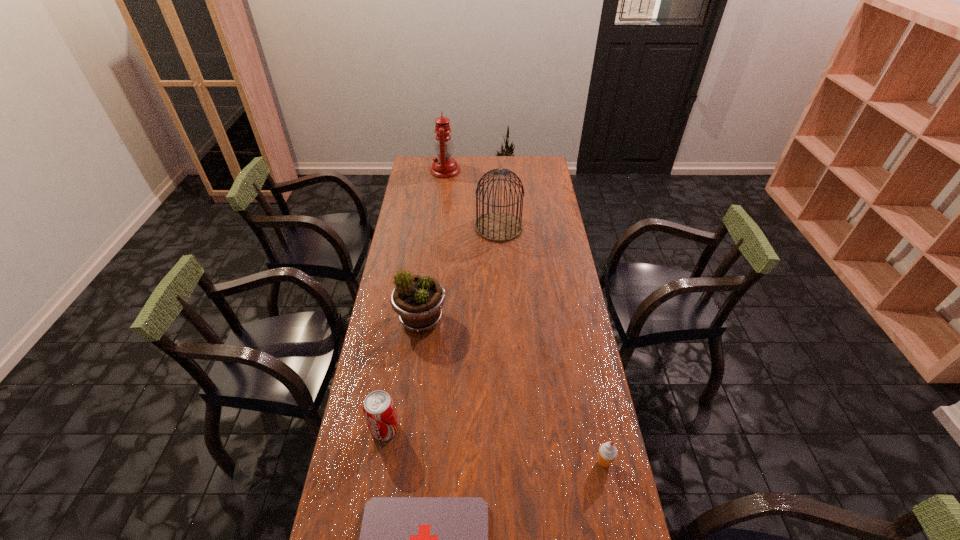
In order to click on vacant region located 0.200m on the back of the third tallest object in this screenshot , I will do `click(428, 265)`.

Identify the location of vacant point located 0.130m on the back of the fourth tallest object. Image resolution: width=960 pixels, height=540 pixels. 394,380.

Where is `vacant space located on the left of the rightmost object`? Image resolution: width=960 pixels, height=540 pixels. vacant space located on the left of the rightmost object is located at coordinates (577, 462).

This screenshot has height=540, width=960. Identify the location of object at the far edge. (x=444, y=166).

I want to click on oil lamp that is at the left edge, so click(x=444, y=166).

The image size is (960, 540). Identify the location of flowerpot that is at the left edge. (418, 300).

Locate an element on the screen. Image resolution: width=960 pixels, height=540 pixels. soda can present at the left edge is located at coordinates (379, 410).

The height and width of the screenshot is (540, 960). What are the coordinates of `object that is at the right edge` in the screenshot? It's located at (607, 453).

The width and height of the screenshot is (960, 540). What are the coordinates of `object at the far left corner` in the screenshot? It's located at (444, 166).

In order to click on vacant space at the left edge in this screenshot , I will do `click(362, 438)`.